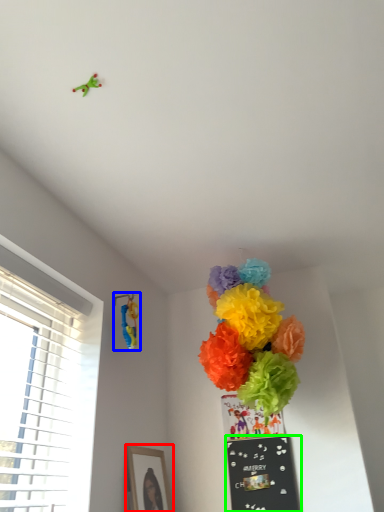
Question: Which object is positioned closest to picture frame (highlighted by a red box)? Select from toy (highlighted by a blue box) and bulletin board (highlighted by a green box).

Choices:
 (A) toy
 (B) bulletin board

Answer: (B)